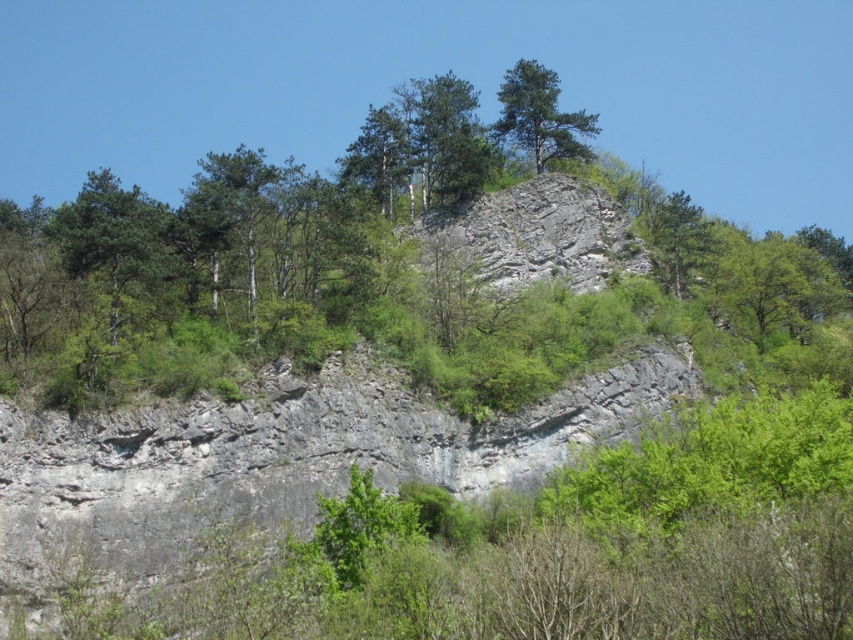
Question: Which of the following is the farthest from the observer?

Choices:
 (A) (521, 102)
 (B) (68, 241)

Answer: (A)

Question: Which object is farther from the camera taking this photo?

Choices:
 (A) green matte tree at upper center
 (B) green matte tree at upper left

Answer: (A)

Question: Among these points, which one is nearest to the camera?

Choices:
 (A) pyautogui.click(x=529, y=147)
 (B) pyautogui.click(x=112, y=221)

Answer: (B)

Question: Can you confirm if green matte tree at upper left is smaller than green matte tree at upper center?

Choices:
 (A) no
 (B) yes

Answer: (A)

Question: Can you confirm if green matte tree at upper left is wider than green matte tree at upper center?

Choices:
 (A) no
 (B) yes

Answer: (B)

Question: Does green matte tree at upper left come behind green matte tree at upper center?

Choices:
 (A) no
 (B) yes

Answer: (A)